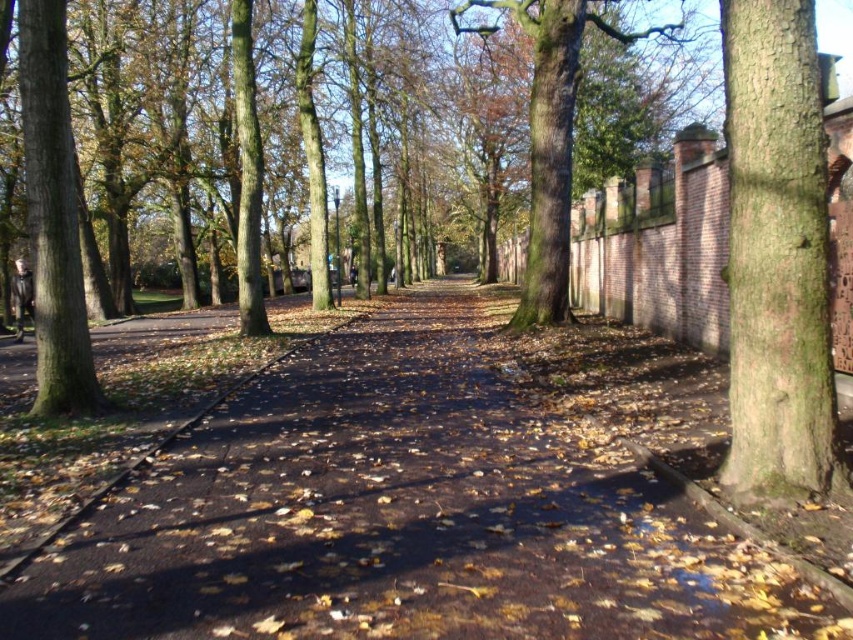
Identify the location of brown asphalt pavement at center. (403, 515).

Which of these two, brown asphalt pavement at center or green rough bark tree at left, stands taller?

green rough bark tree at left

Is point (403, 529) farther from camera compared to point (61, 316)?

That is False.

Find the location of a particular element. The image size is (853, 640). brown asphalt pavement at center is located at coordinates tap(403, 515).

Between brown asphalt pavement at center and smooth brown bark at right, which one is positioned lower?

brown asphalt pavement at center is lower down.

Does brown asphalt pavement at center have a lesser width compared to smooth brown bark at right?

No.

Locate an element on the screen. The width and height of the screenshot is (853, 640). brown asphalt pavement at center is located at coordinates (403, 515).

Locate an element on the screen. brown asphalt pavement at center is located at coordinates (403, 515).

Is smooth brown bark at right to the left of green rough bark tree at left from the viewer's perspective?

In fact, smooth brown bark at right is to the right of green rough bark tree at left.

How much distance is there between smooth brown bark at right and green rough bark tree at left?

A distance of 25.62 feet exists between smooth brown bark at right and green rough bark tree at left.

Does point (799, 449) lie behind point (45, 77)?

That is False.

You are a GUI agent. You are given a task and a screenshot of the screen. Output one action in this format:
    pyautogui.click(x=<x>, y=<y>)
    Task: Click on the smooth brown bark at right
    The height and width of the screenshot is (640, 853).
    Given the screenshot: What is the action you would take?
    pyautogui.click(x=776, y=257)